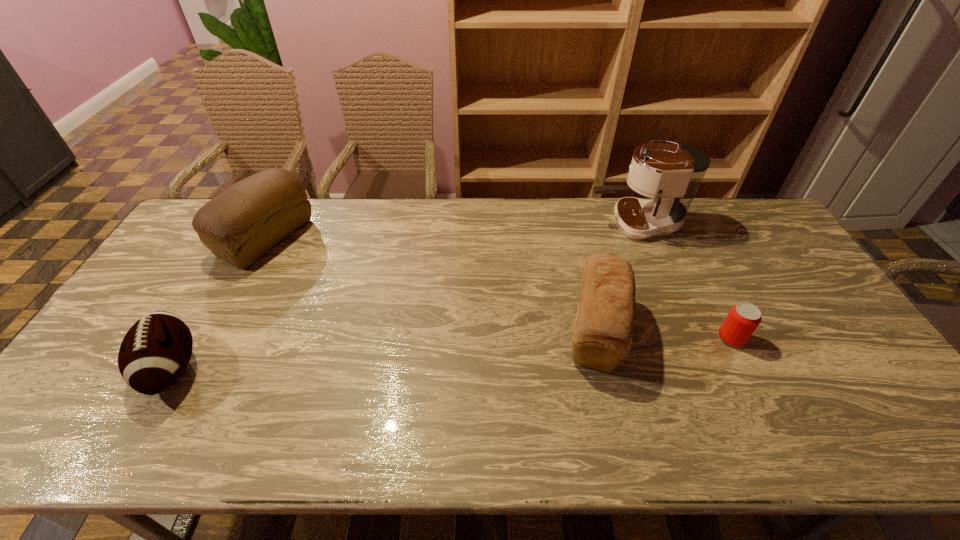
Locate an element on the screen. This screenshot has width=960, height=540. the tallest object is located at coordinates (671, 174).

The width and height of the screenshot is (960, 540). Find the location of `the left bread`. the left bread is located at coordinates (241, 224).

Locate an element on the screen. The image size is (960, 540). the nearer bread is located at coordinates (602, 337).

Identify the location of football (American). (154, 353).

The image size is (960, 540). What are the coordinates of `the shortest object` in the screenshot? It's located at (742, 320).

At what (x,y) coordinates should I click in order to perform the action: click on blank area located on the front-facing side of the coffee maker. Please return your answer as a coordinate pair (x, y). The width and height of the screenshot is (960, 540). Looking at the image, I should click on (487, 224).

At what (x,y) coordinates should I click in order to perform the action: click on vacant space located 0.260m on the front-facing side of the coffee maker. Please return your answer as a coordinate pair (x, y). The width and height of the screenshot is (960, 540). Looking at the image, I should click on (512, 224).

Image resolution: width=960 pixels, height=540 pixels. Find the location of `vacant area situated on the front-facing side of the coffee maker`. vacant area situated on the front-facing side of the coffee maker is located at coordinates (495, 224).

Where is `vacant space situated on the right of the farther bread`? vacant space situated on the right of the farther bread is located at coordinates (389, 238).

Locate an element on the screen. vacant area located 0.310m on the left of the right bread is located at coordinates (447, 330).